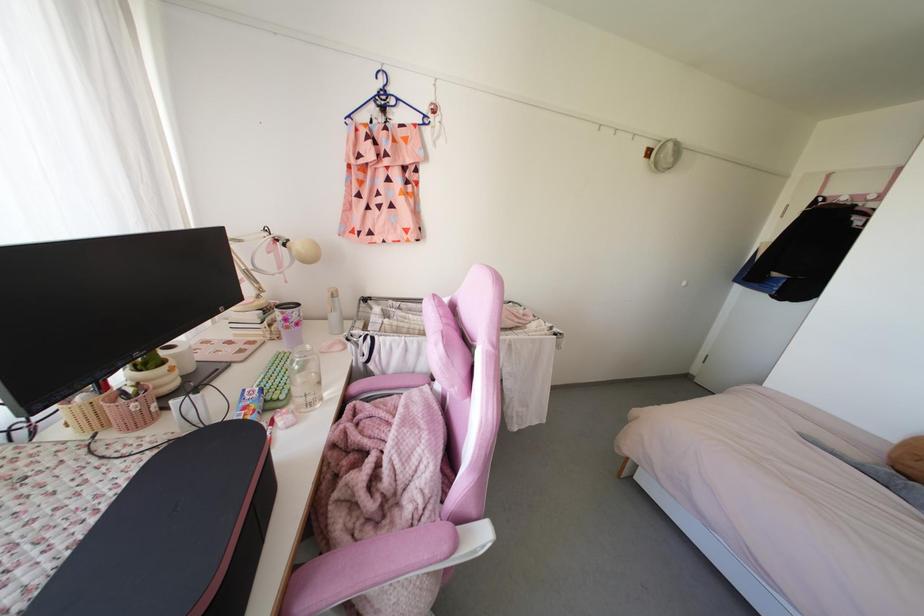
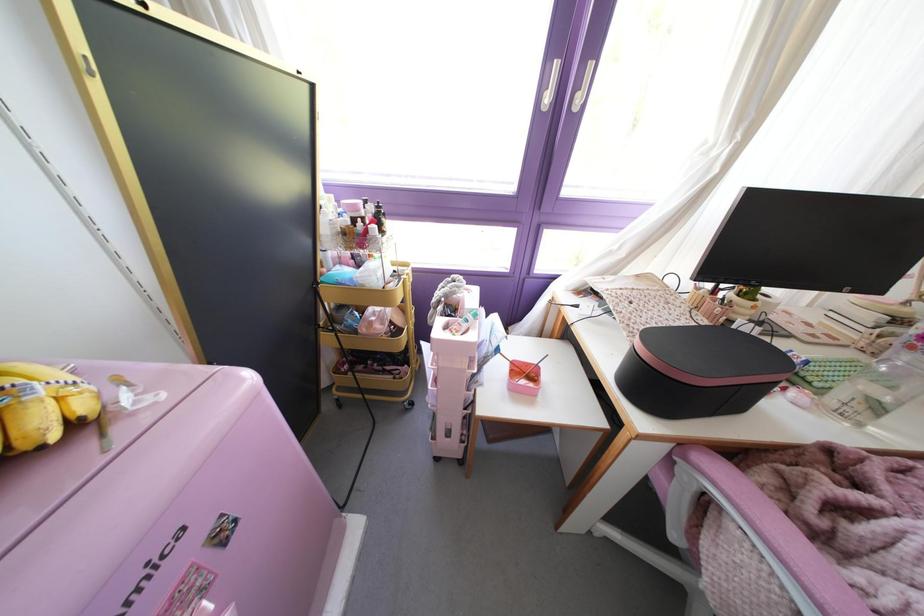
First-person continuous shooting, in which direction is the camera rotating?

The rotation direction of the camera is left-down.